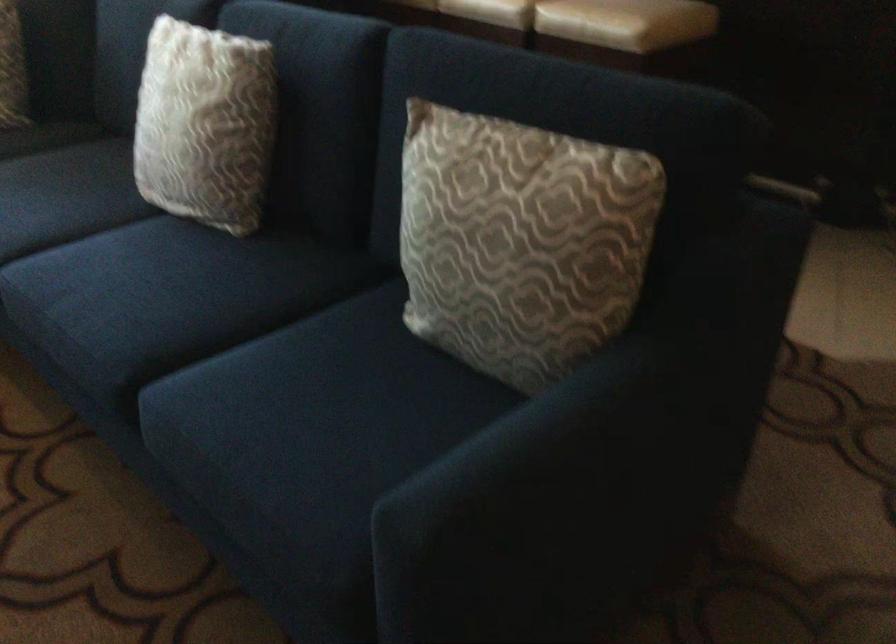
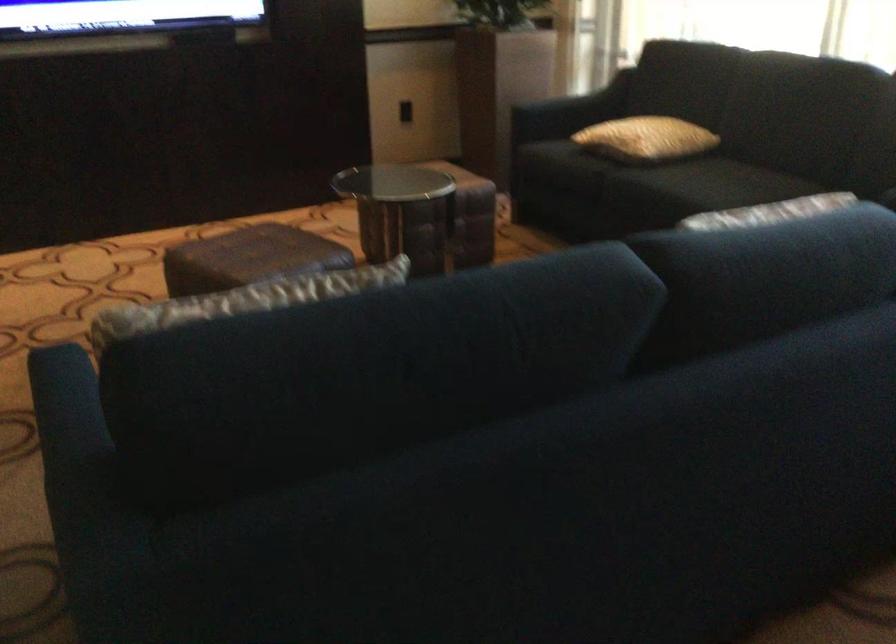
In the second image, find the point that corresponds to point 599,366 in the first image.

(69, 431)